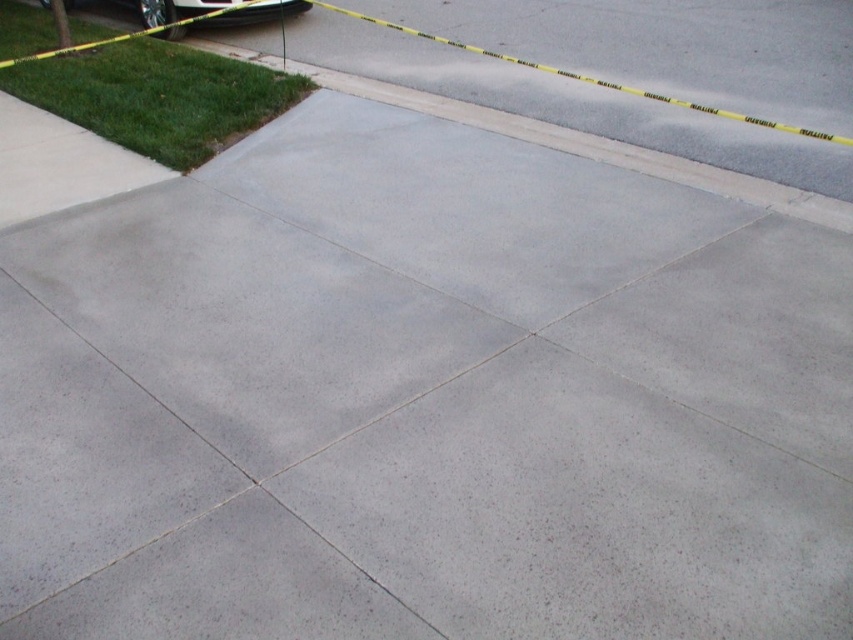
Question: Does gray concrete curb at upper left appear over shiny black car at upper left?

Choices:
 (A) no
 (B) yes

Answer: (A)

Question: Is gray concrete curb at upper left to the right of shiny black car at upper left from the viewer's perspective?

Choices:
 (A) yes
 (B) no

Answer: (A)

Question: Which object is farther from the camera taking this photo?

Choices:
 (A) gray concrete curb at upper left
 (B) shiny black car at upper left

Answer: (B)

Question: From the image, what is the correct spatial relationship of gray concrete curb at upper left in relation to shiny black car at upper left?

Choices:
 (A) right
 (B) left

Answer: (A)

Question: Which point is closer to the camera taking this photo?

Choices:
 (A) (21, 202)
 (B) (178, 29)

Answer: (A)